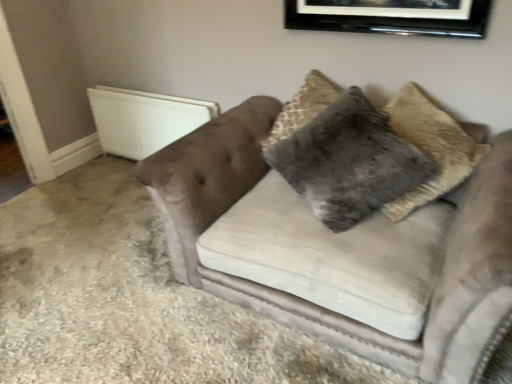
Question: Is velvet couch at center wider or thinner than black glossy picture frame at upper center?

Choices:
 (A) wide
 (B) thin

Answer: (A)

Question: Is velvet couch at center bigger or smaller than black glossy picture frame at upper center?

Choices:
 (A) small
 (B) big

Answer: (B)

Question: Which is farther from the white plastic radiator at left?

Choices:
 (A) velvet couch at center
 (B) black glossy picture frame at upper center
 (C) fuzzy gray pillow at center

Answer: (B)

Question: Which is nearer to the velvet couch at center?

Choices:
 (A) black glossy picture frame at upper center
 (B) white plastic radiator at left
 (C) fuzzy gray pillow at center

Answer: (C)